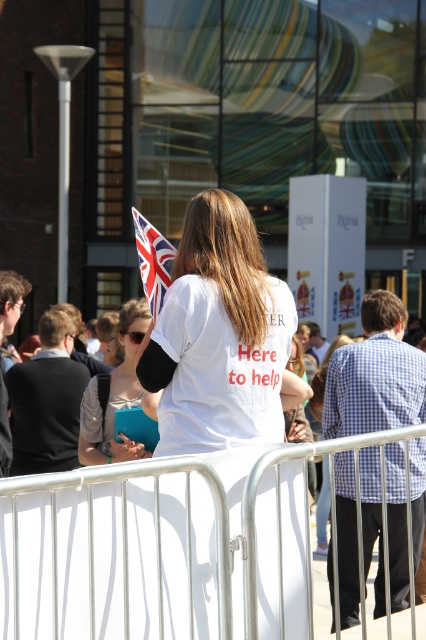
Question: Is white matte shirt at center behind polyester flag at upper center?

Choices:
 (A) yes
 (B) no

Answer: (B)

Question: Can you confirm if white metal fence at center is wider than polyester flag at upper center?

Choices:
 (A) yes
 (B) no

Answer: (A)

Question: Among these objects, which one is nearest to the camera?

Choices:
 (A) white matte shirt at center
 (B) polyester flag at upper center

Answer: (A)

Question: Can you confirm if white metal fence at center is positioned above white fabric shirt at center?

Choices:
 (A) yes
 (B) no

Answer: (B)

Question: Which of the following is the closest to the observer?

Choices:
 (A) (135, 620)
 (B) (196, 330)
 (C) (109, 392)

Answer: (A)

Question: Which point is farther from the camera taking this photo?

Choices:
 (A) (23, 625)
 (B) (247, 387)
 (C) (143, 291)

Answer: (C)